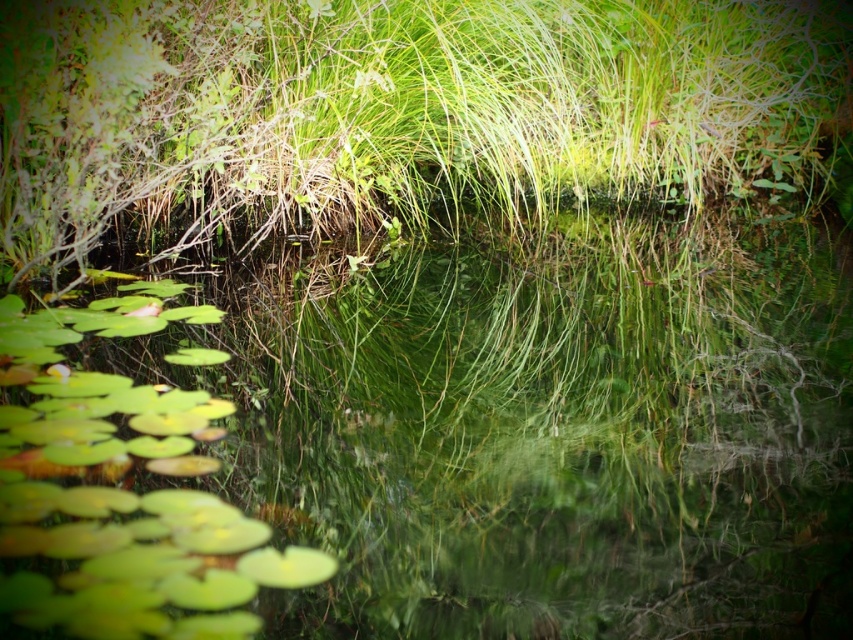
Can you confirm if green grass at center is positioned to the left of green glossy lily pads at lower left?

Indeed, green grass at center is positioned on the left side of green glossy lily pads at lower left.

Find the location of a particular element. The width and height of the screenshot is (853, 640). green grass at center is located at coordinates (392, 108).

This screenshot has height=640, width=853. What are the coordinates of `green grass at center` in the screenshot? It's located at (392, 108).